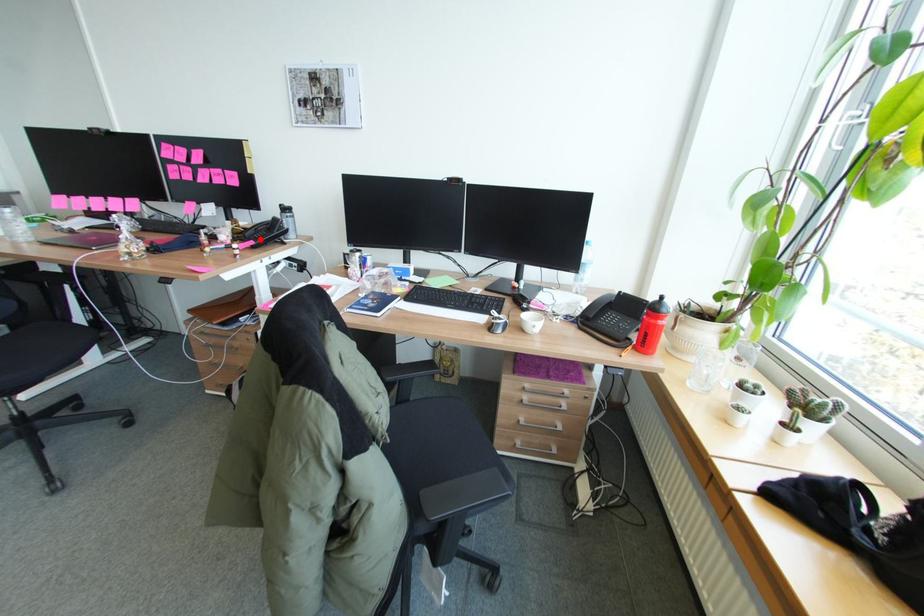
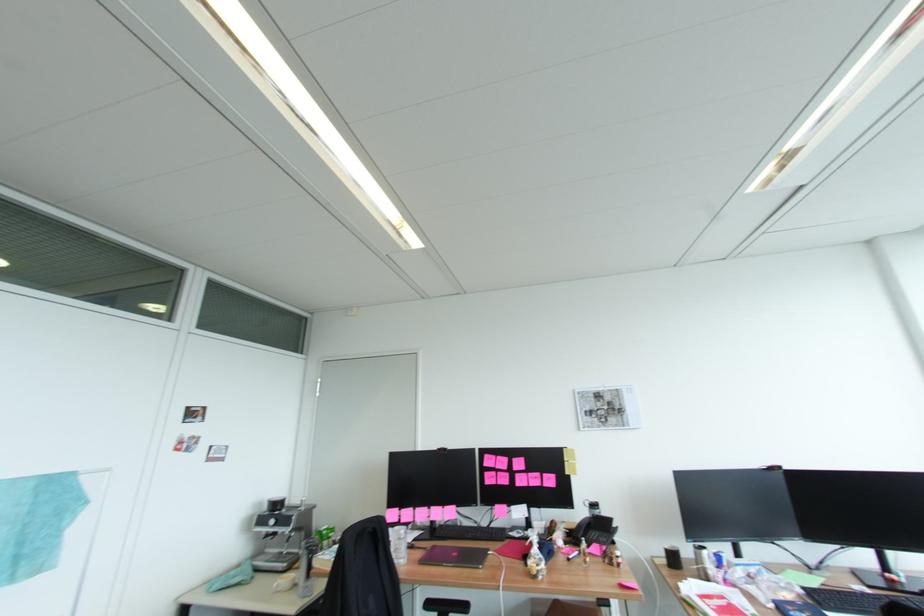
The point at the highlighted location is marked in the first image. Where is the corresponding point in the second image?

(603, 541)